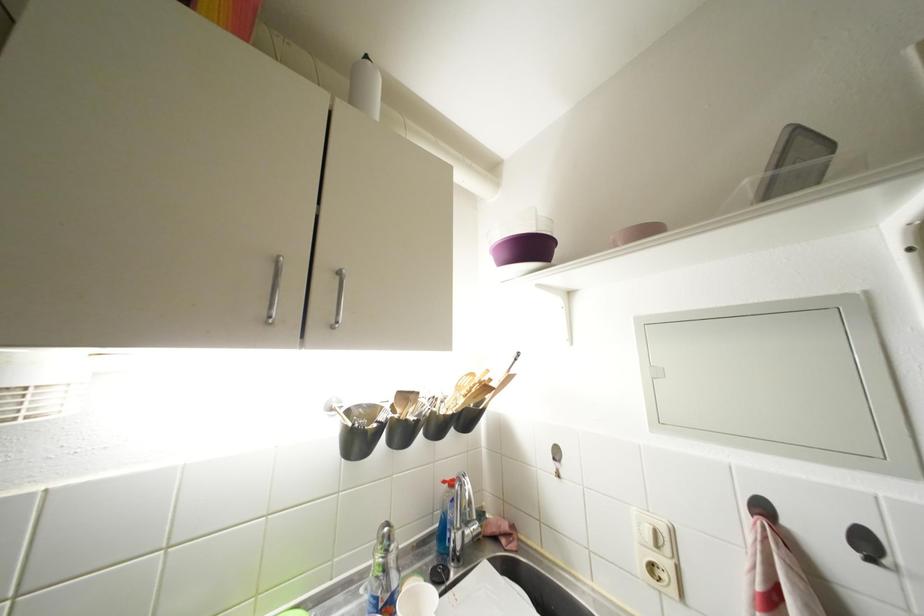
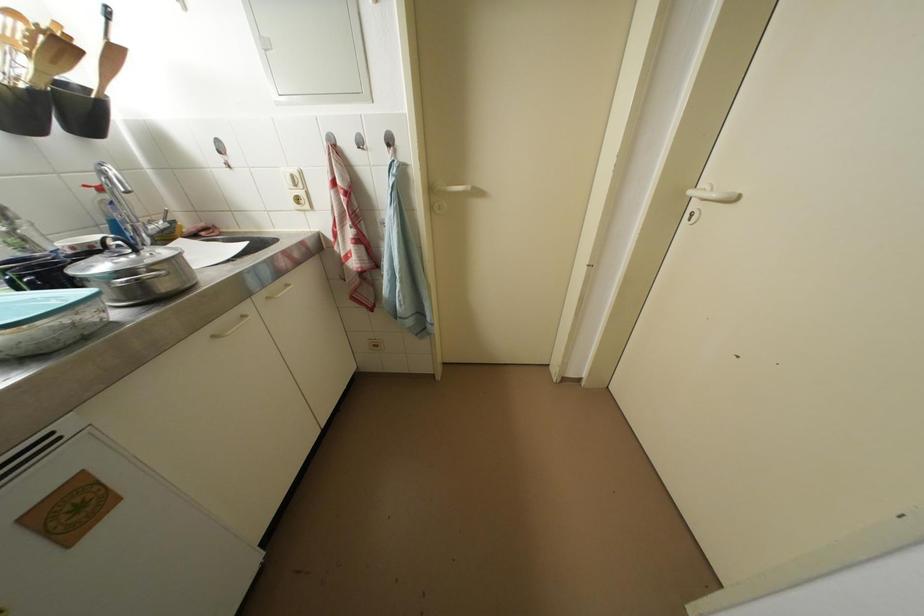
Find the pixel in the second image that matches point (492, 392) in the first image.

(69, 50)